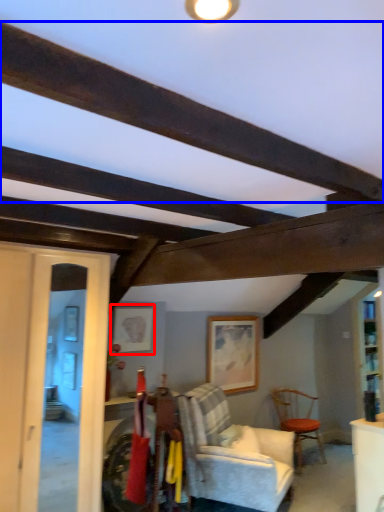
Question: Among these objects, which one is nearest to the camera, picture frame (highlighted by a red box) or plank (highlighted by a blue box)?

Choices:
 (A) picture frame
 (B) plank

Answer: (B)